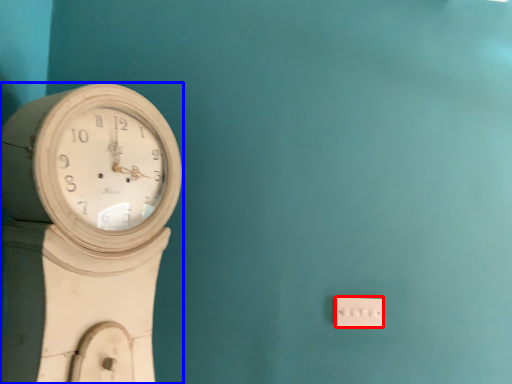
Question: Which object appears farthest to the camera in this image, electric outlet (highlighted by a red box) or wall clock (highlighted by a blue box)?

Choices:
 (A) electric outlet
 (B) wall clock

Answer: (A)